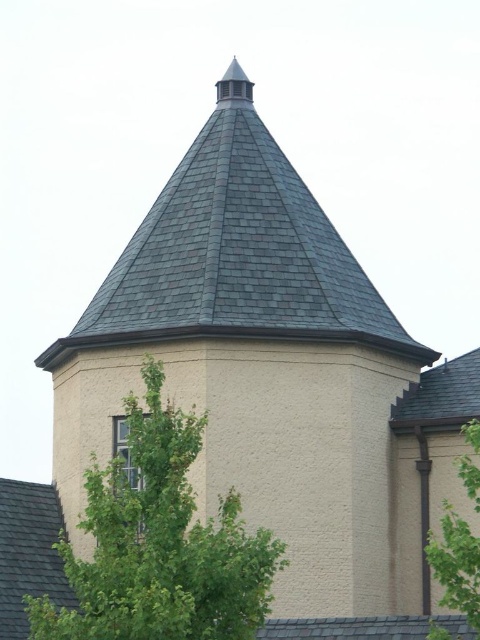
Question: Which of the following is the farthest from the observer?

Choices:
 (A) (463, 396)
 (B) (84, 314)
 (C) (172, 472)

Answer: (B)

Question: Can you confirm if green leafy tree at right is positioned to the left of gray shingles at upper right?

Choices:
 (A) no
 (B) yes

Answer: (B)

Question: Which of the following is the farthest from the observer?

Choices:
 (A) gray shingles at lower left
 (B) green leafy tree at lower left
 (C) gray shingles at upper center
 (D) gray shingles at upper right

Answer: (D)

Question: Is the position of green leafy tree at lower left less distant than that of green leafy tree at right?

Choices:
 (A) yes
 (B) no

Answer: (A)

Question: Which object is farther from the camera taking this photo?

Choices:
 (A) green leafy tree at right
 (B) gray shingles at lower left
 (C) gray shingles at upper center

Answer: (C)

Question: Does green leafy tree at lower left appear on the right side of gray shingles at upper right?

Choices:
 (A) no
 (B) yes

Answer: (A)